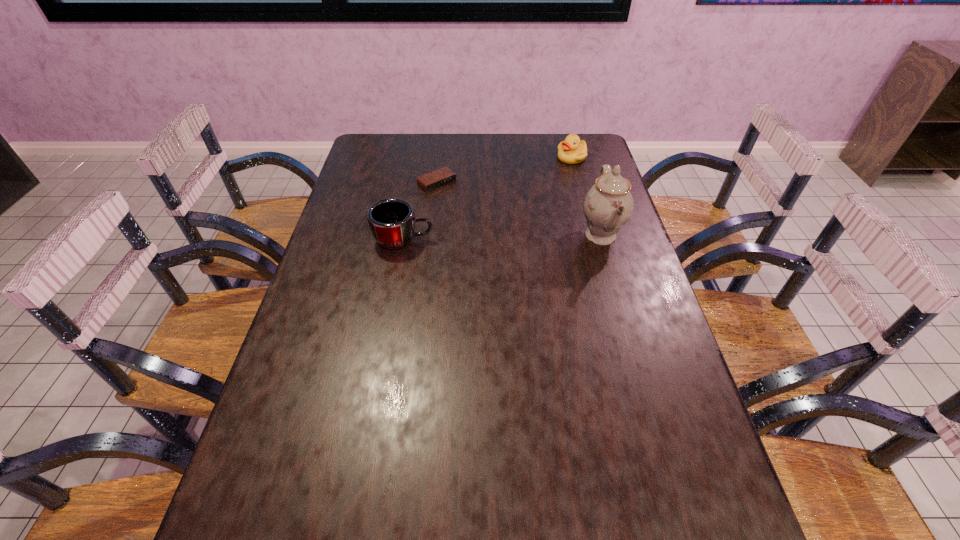
The width and height of the screenshot is (960, 540). What are the coordinates of `free space located 0.380m on the front face of the alarm clock` in the screenshot? It's located at (520, 254).

You are a GUI agent. You are given a task and a screenshot of the screen. Output one action in this format:
    pyautogui.click(x=<x>, y=<y>)
    Task: Click on the free space located on the front face of the alarm clock
    
    Given the screenshot: What is the action you would take?
    pyautogui.click(x=503, y=239)

I want to click on object at the far edge, so click(x=572, y=150).

The width and height of the screenshot is (960, 540). What are the coordinates of `object at the left edge` in the screenshot? It's located at (392, 221).

Where is `chinaware that is at the right edge`? This screenshot has width=960, height=540. chinaware that is at the right edge is located at coordinates (608, 205).

The height and width of the screenshot is (540, 960). What are the coordinates of `duckling located at the right edge` in the screenshot? It's located at (572, 150).

Locate an element on the screen. object positioned at the far right corner is located at coordinates click(572, 150).

Locate an element on the screen. The width and height of the screenshot is (960, 540). vacant position at the far edge of the desktop is located at coordinates (419, 136).

In order to click on blank space at the near edge of the desktop in this screenshot , I will do `click(359, 469)`.

At what (x,y) coordinates should I click in order to perform the action: click on free spot at the left edge of the desktop. Please return your answer as a coordinate pair (x, y). This screenshot has width=960, height=540. Looking at the image, I should click on (373, 261).